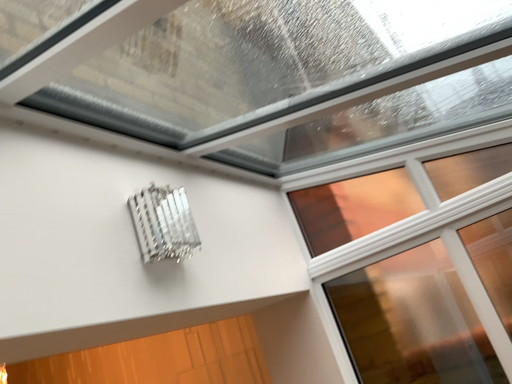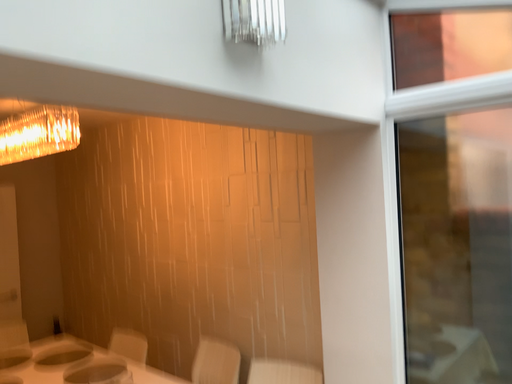
Question: Which way did the camera rotate in the video?

Choices:
 (A) rotated left
 (B) rotated right

Answer: (A)